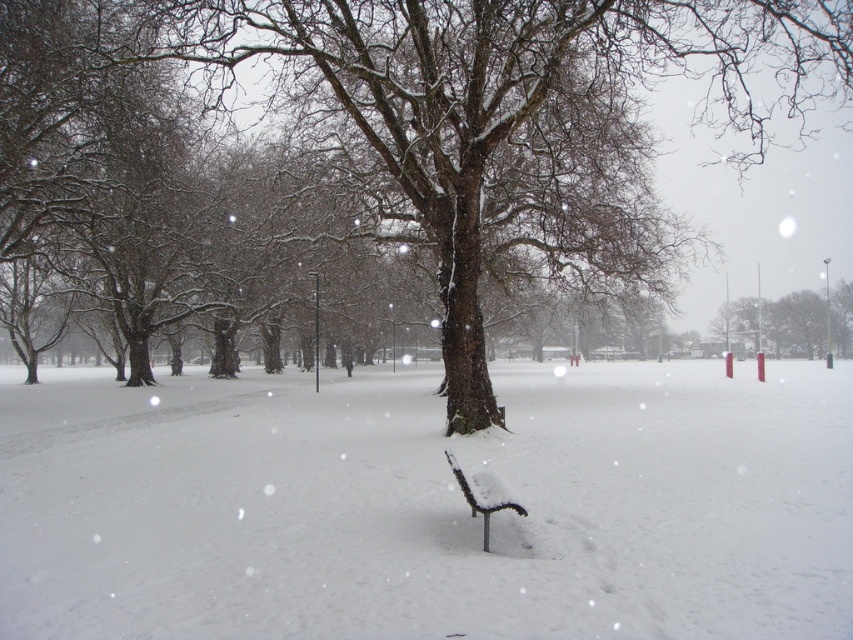
Question: Which of the following is the farthest from the observer?

Choices:
 (A) snow-covered wood bench at center
 (B) smooth red pole at center
 (C) snow-covered tree at center
 (D) white matte bench at center

Answer: (B)

Question: Does smooth red pole at center appear on the left side of snow-covered wood bench at center?

Choices:
 (A) yes
 (B) no

Answer: (B)

Question: Which object appears closest to the camera in this image?

Choices:
 (A) snow-covered tree at center
 (B) snow-covered wood bench at center
 (C) smooth red pole at center

Answer: (B)

Question: Does white matte bench at center have a greater width compared to snow-covered tree at center?

Choices:
 (A) no
 (B) yes

Answer: (A)

Question: Which is farther from the white matte bench at center?

Choices:
 (A) smooth red pole at center
 (B) snow-covered wood bench at center
 (C) snow-covered tree at center

Answer: (A)

Question: From the image, what is the correct spatial relationship of snow-covered tree at center in relation to smooth red pole at center?

Choices:
 (A) right
 (B) left

Answer: (B)